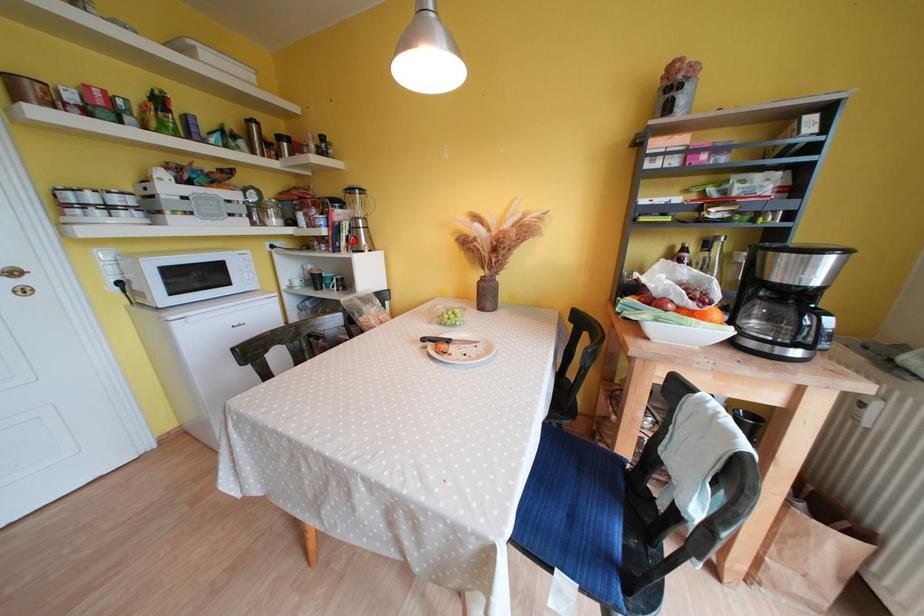
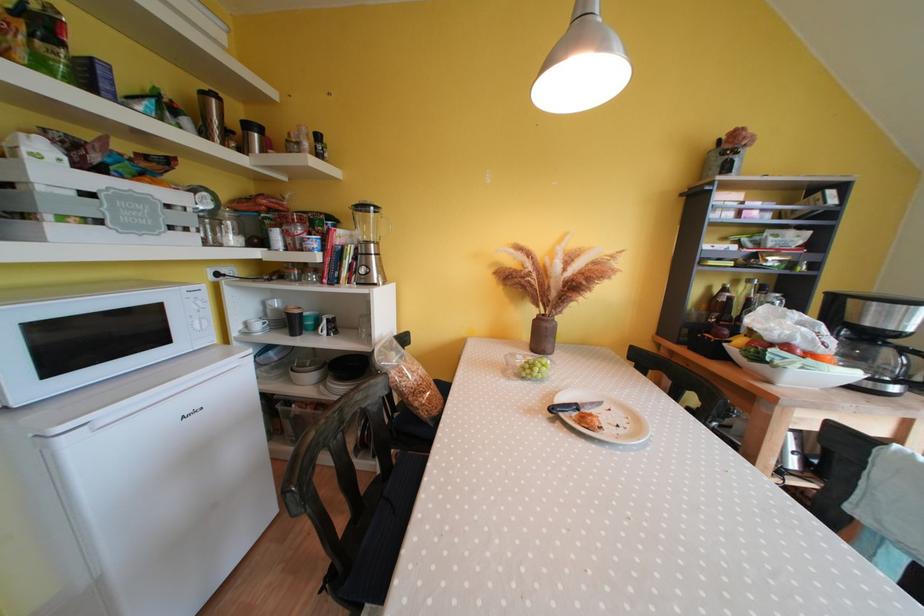
Where in the second image is the point corresponding to the highlighted location from the first image?

(357, 269)